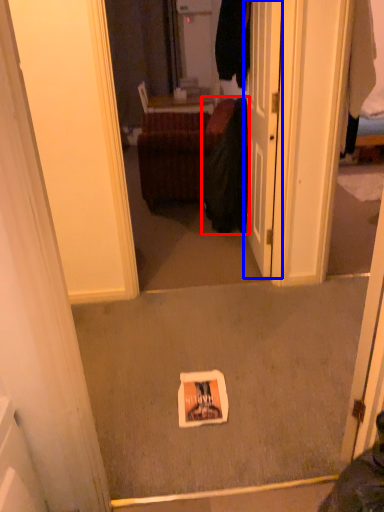
Question: Which point is closer to the camera, clothing (highlighted by a red box) or door (highlighted by a blue box)?

Choices:
 (A) clothing
 (B) door

Answer: (B)